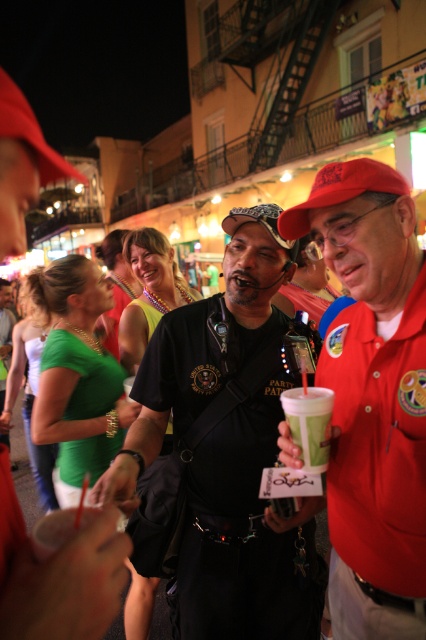
Between black matte shirt at center and red matte baseball cap at center, which one appears on the left side from the viewer's perspective?

black matte shirt at center

Which is below, black matte shirt at center or red matte baseball cap at center?

Positioned lower is black matte shirt at center.

Locate an element on the screen. black matte shirt at center is located at coordinates (227, 445).

Who is higher up, matte red cap at center or green paper cup at center?

Positioned higher is matte red cap at center.

Between point (377, 349) and point (304, 435), which one is positioned in front?

Point (304, 435)

Identify the location of matte red cap at center. The width and height of the screenshot is (426, 640). (373, 396).

At what (x,y) coordinates should I click in order to perform the action: click on matte red cap at center. Please return your answer as a coordinate pair (x, y). Looking at the image, I should click on (373, 396).

What do you see at coordinates (227, 445) in the screenshot?
I see `black matte shirt at center` at bounding box center [227, 445].

Consider the image. Who is taller, black matte shirt at center or matte red cap at center?

black matte shirt at center is taller.

In order to click on black matte shirt at center in this screenshot , I will do `click(227, 445)`.

Where is `black matte shirt at center`? The height and width of the screenshot is (640, 426). black matte shirt at center is located at coordinates (227, 445).